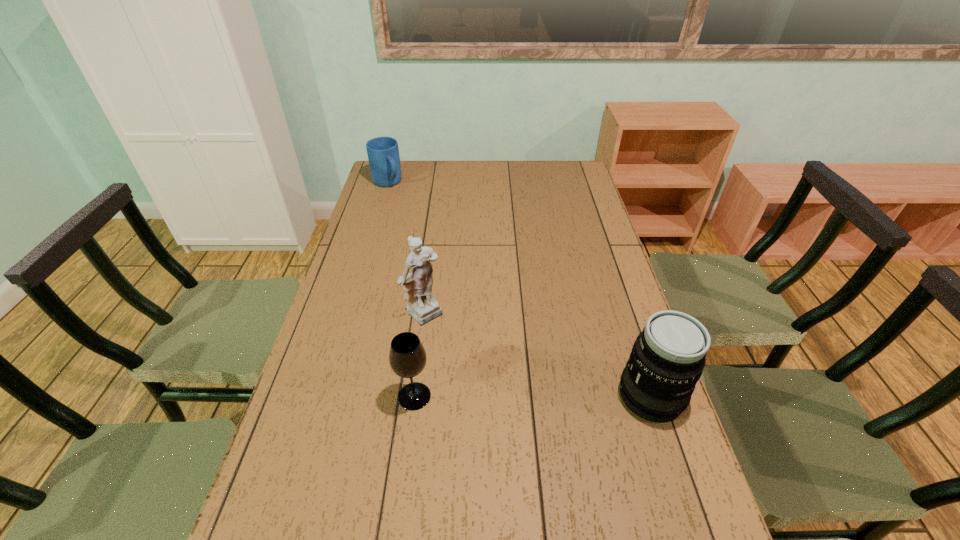
Image resolution: width=960 pixels, height=540 pixels. In order to click on vacant area that lies between the shortest object and the telephoto lens in this screenshot , I will do `click(518, 289)`.

This screenshot has height=540, width=960. In order to click on empty location between the leftmost object and the third nearest object in this screenshot , I will do coord(407,248).

This screenshot has width=960, height=540. I want to click on free space between the rightmost object and the tallest object, so click(539, 354).

This screenshot has height=540, width=960. I want to click on the closest object to the second shortest object, so click(422, 305).

Select which object appears as the third closest to the third tallest object. Please provide its 2D coordinates. Your answer should be formatted as a tuple, i.e. [(x, y)], where the tuple contains the x and y coordinates of a point satisfying the conditions above.

[(383, 153)]

At what (x,y) coordinates should I click in order to perform the action: click on vacant area that satisfies the following two spatial constraints: 1. on the front side of the wineglass; 2. on the left side of the shortest object. Please return your answer as a coordinate pair (x, y). Image resolution: width=960 pixels, height=540 pixels. Looking at the image, I should click on (322, 396).